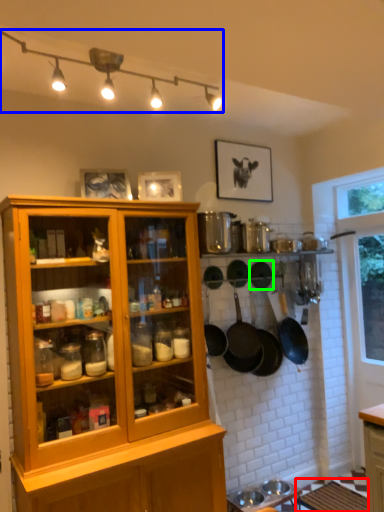
Question: Based on their relative distances, which object is farther from table (highlighted by a red box)? Choose from light fixture (highlighted by a blue box) and frying pan (highlighted by a green box).

Choices:
 (A) light fixture
 (B) frying pan

Answer: (A)